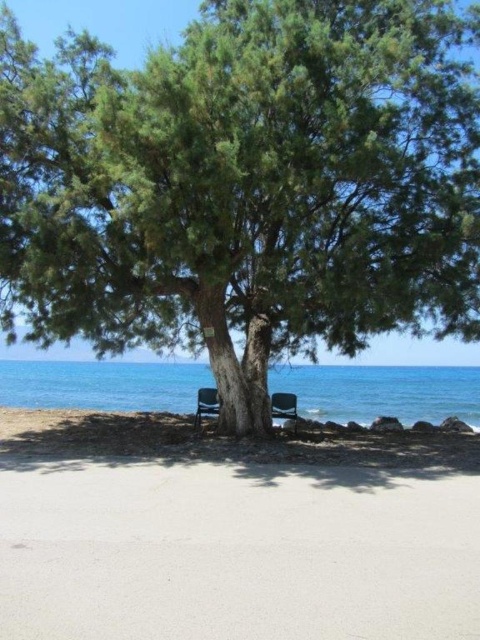
Question: Is green textured tree at center bigger than brown sand at lower center?

Choices:
 (A) no
 (B) yes

Answer: (B)

Question: Which of these objects is positioned closest to the sandy beige beach at lower center?

Choices:
 (A) brown sand at lower center
 (B) green textured tree at center

Answer: (A)

Question: Which point appears farthest from the camera in this image?

Choices:
 (A) (75, 268)
 (B) (287, 397)
 (C) (207, 406)
 (D) (342, 456)

Answer: (B)

Question: Is green textured tree at center bigger than sandy beige beach at lower center?

Choices:
 (A) yes
 (B) no

Answer: (A)

Question: Which of the following is the closest to the observer?

Choices:
 (A) (315, 380)
 (B) (231, 452)
 (C) (288, 406)
 (D) (93, 566)

Answer: (D)

Question: Does brown sand at lower center have a larger size compared to black plastic chair at lower center?

Choices:
 (A) no
 (B) yes

Answer: (B)